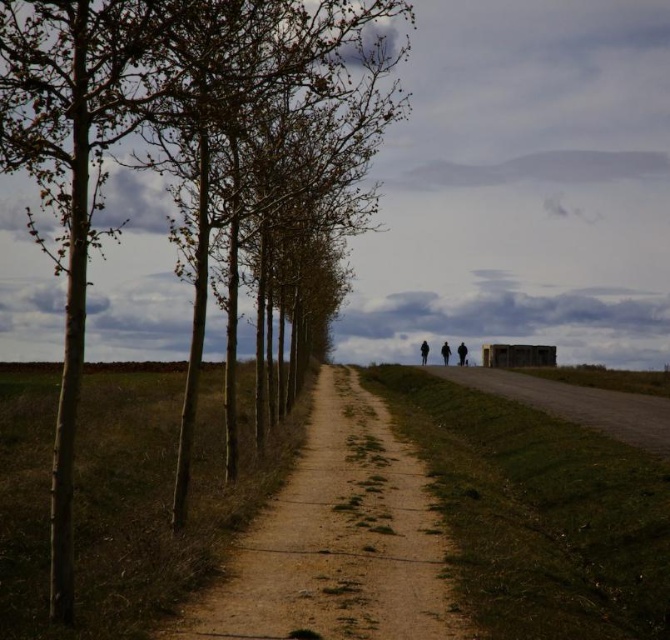
Question: Does dark gray fabric jacket at center-right appear over dark brown leather jacket at center?

Choices:
 (A) yes
 (B) no

Answer: (B)

Question: Does brown dirt track at center come behind dark textured coat at center?

Choices:
 (A) no
 (B) yes

Answer: (A)

Question: Based on their relative distances, which object is nearer to the dark textured coat at center?

Choices:
 (A) smooth bark trees at left
 (B) dark gray fabric jacket at center-right
 (C) dark brown leather jacket at center

Answer: (C)

Question: Which object appears farthest from the camera in this image?

Choices:
 (A) brown dirt track at center
 (B) smooth bark trees at left
 (C) dark brown leather jacket at center

Answer: (C)

Question: Does dark brown leather jacket at center appear under dark textured coat at center?

Choices:
 (A) yes
 (B) no

Answer: (A)

Question: Which point is farther to the camera?

Choices:
 (A) brown dirt track at center
 (B) dark gray fabric jacket at center-right
 (C) dark textured coat at center
 (D) dark brown leather jacket at center

Answer: (C)